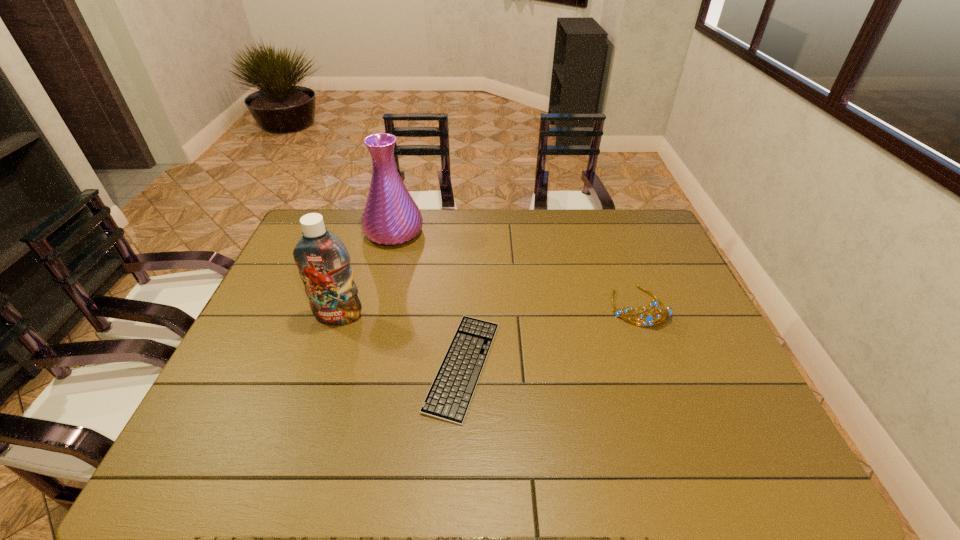
The width and height of the screenshot is (960, 540). I want to click on vase, so click(390, 217).

Where is `shampoo`? This screenshot has height=540, width=960. shampoo is located at coordinates (323, 261).

This screenshot has height=540, width=960. Identify the location of the rightmost object. (648, 319).

Where is `the third tallest object`? The height and width of the screenshot is (540, 960). the third tallest object is located at coordinates (648, 319).

Find the location of a particular element. the shortest object is located at coordinates (449, 397).

Identify the location of computer keyboard. (449, 397).

What are the coordinates of `vacant position located 0.050m on the back of the farthest object` in the screenshot? It's located at (400, 209).

At what (x,y) coordinates should I click in order to perform the action: click on vacant area situated on the front label of the shampoo. Please return your answer as a coordinate pair (x, y). Looking at the image, I should click on (296, 444).

Locate an element on the screen. The height and width of the screenshot is (540, 960). vacant space positioned on the front-facing side of the rightmost object is located at coordinates (675, 400).

Locate an element on the screen. The width and height of the screenshot is (960, 540). blank space located on the right of the computer keyboard is located at coordinates (602, 366).